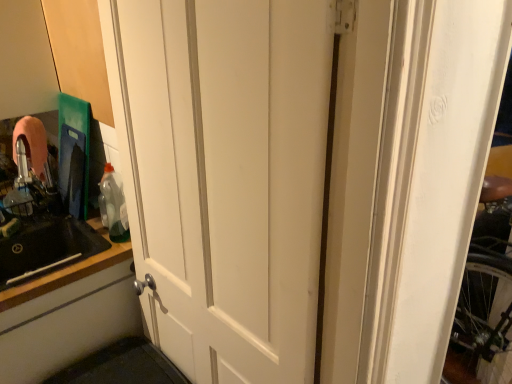
This screenshot has width=512, height=384. What are the coordinates of `white matte cabinet door at lower left` in the screenshot? It's located at (67, 325).

The width and height of the screenshot is (512, 384). Describe the element at coordinates (40, 229) in the screenshot. I see `black matte sink at left` at that location.

Find the location of a particular element. The height and width of the screenshot is (384, 512). white matte cabinet door at lower left is located at coordinates (67, 325).

From the image's perspective, is white matte cabinet door at lower left on top of black matte countertop at left?

No, from the image's perspective, white matte cabinet door at lower left is not over black matte countertop at left.

Between white matte cabinet door at lower left and black matte countertop at left, which one appears on the right side from the viewer's perspective?

white matte cabinet door at lower left is more to the right.

Would you say white matte cabinet door at lower left is inside or outside black matte countertop at left?

The correct answer is: outside.

Is white matte cabinet door at lower left placed right next to black matte countertop at left?

No.

Considering the positions of objects translucent plastic bottle at left and white matte cabinet door at lower left in the image provided, who is behind, translucent plastic bottle at left or white matte cabinet door at lower left?

translucent plastic bottle at left is more distant.

Find the location of `bottle above the white matte cabinet door at lower left (from the image's perspective)`. bottle above the white matte cabinet door at lower left (from the image's perspective) is located at coordinates [x=113, y=205].

From the image's perspective, is translucent plastic bottle at left located above or below white matte cabinet door at lower left?

From the image's perspective, translucent plastic bottle at left appears above white matte cabinet door at lower left.

Which object is wider, translucent plastic bottle at left or white matte cabinet door at lower left?

translucent plastic bottle at left is wider.

Can you confirm if translucent plastic bottle at left is taller than black matte countertop at left?

In fact, translucent plastic bottle at left may be shorter than black matte countertop at left.

Does translucent plastic bottle at left have a greater width compared to black matte countertop at left?

No.

Is translucent plastic bottle at left aimed at black matte countertop at left?

Yes, translucent plastic bottle at left faces towards black matte countertop at left.

Can you confirm if white matte cabinet door at lower left is bigger than translucent plastic bottle at left?

No, white matte cabinet door at lower left is not bigger than translucent plastic bottle at left.

From a real-world perspective, is white matte cabinet door at lower left physically below translucent plastic bottle at left?

Indeed, from a real-world perspective, white matte cabinet door at lower left is positioned beneath translucent plastic bottle at left.

Is white matte cabinet door at lower left looking in the opposite direction of translucent plastic bottle at left?

No, white matte cabinet door at lower left's orientation is not away from translucent plastic bottle at left.

Considering the relative positions of white matte cabinet door at lower left and translucent plastic bottle at left in the image provided, is white matte cabinet door at lower left to the right of translucent plastic bottle at left from the viewer's perspective?

No, white matte cabinet door at lower left is not to the right of translucent plastic bottle at left.

Is white matte cabinet door at lower left far away from black matte sink at left?

No.

Is white matte cabinet door at lower left facing towards black matte sink at left?

No, white matte cabinet door at lower left is not oriented towards black matte sink at left.

Can you confirm if white matte cabinet door at lower left is positioned to the right of black matte sink at left?

Yes.

You are a GUI agent. You are given a task and a screenshot of the screen. Output one action in this format:
    pyautogui.click(x=<x>, y=<y>)
    Task: Click on the counter top that is under the black matte sink at left (from a real-world perspective)
    Image resolution: width=512 pixels, height=384 pixels.
    Given the screenshot: What is the action you would take?
    pyautogui.click(x=68, y=272)

Are black matte countertop at left and black matte sink at left beside each other?

No, black matte countertop at left is not touching black matte sink at left.

Which object is thinner, black matte countertop at left or black matte sink at left?

black matte countertop at left.

Is black matte countertop at left positioned with its back to black matte sink at left?

Absolutely, black matte countertop at left is directed away from black matte sink at left.

Would you say black matte sink at left is to the left or to the right of translucent plastic bottle at left in the picture?

From the image, it's evident that black matte sink at left is to the left of translucent plastic bottle at left.

Which is behind, black matte sink at left or translucent plastic bottle at left?

translucent plastic bottle at left is further away from the camera.

Is translucent plastic bottle at left a part of black matte sink at left?

No, translucent plastic bottle at left is not a part of black matte sink at left.

How different are the orientations of black matte sink at left and translucent plastic bottle at left in degrees?

The angle between the facing direction of black matte sink at left and the facing direction of translucent plastic bottle at left is 1.68 degrees.

The width and height of the screenshot is (512, 384). Find the location of `counter top that is behind the white matte cabinet door at lower left`. counter top that is behind the white matte cabinet door at lower left is located at coordinates tap(68, 272).

I want to click on cabinetry in front of the translucent plastic bottle at left, so click(67, 325).

Considering their positions, is black matte countertop at left positioned closer to white matte cabinet door at lower left than translucent plastic bottle at left?

black matte countertop at left is positioned closer to the anchor white matte cabinet door at lower left.

When comparing their distances from translucent plastic bottle at left, does black matte countertop at left or white matte cabinet door at lower left seem closer?

Based on the image, black matte countertop at left appears to be nearer to translucent plastic bottle at left.

From the image, which object appears to be farther from black matte sink at left, translucent plastic bottle at left or white matte cabinet door at lower left?

The object further to black matte sink at left is white matte cabinet door at lower left.

Looking at the image, which one is located closer to black matte countertop at left, translucent plastic bottle at left or white matte cabinet door at lower left?

white matte cabinet door at lower left is closer to black matte countertop at left.

Which object lies nearer to the anchor point black matte sink at left, white matte cabinet door at lower left or translucent plastic bottle at left?

The object closer to black matte sink at left is translucent plastic bottle at left.

Based on the photo, from the image, which object appears to be farther from black matte sink at left, black matte countertop at left or white matte cabinet door at lower left?

white matte cabinet door at lower left is positioned further to the anchor black matte sink at left.

From the image, which object appears to be nearer to white matte cabinet door at lower left, black matte countertop at left or black matte sink at left?

black matte countertop at left is closer to white matte cabinet door at lower left.

Which object lies nearer to the anchor point translucent plastic bottle at left, white matte cabinet door at lower left or black matte countertop at left?

Among the two, black matte countertop at left is located nearer to translucent plastic bottle at left.

You are a GUI agent. You are given a task and a screenshot of the screen. Output one action in this format:
    pyautogui.click(x=<x>, y=<y>)
    Task: Click on the counter top between black matte sink at left and translucent plastic bottle at left in the front-back direction
    This screenshot has height=384, width=512.
    Given the screenshot: What is the action you would take?
    coord(68,272)

At what (x,y) coordinates should I click in order to perform the action: click on counter top between white matte cabinet door at lower left and translucent plastic bottle at left in the front-back direction. Please return your answer as a coordinate pair (x, y). Image resolution: width=512 pixels, height=384 pixels. Looking at the image, I should click on (68, 272).

This screenshot has width=512, height=384. Find the location of `cabinetry between black matte sink at left and translucent plastic bottle at left along the z-axis`. cabinetry between black matte sink at left and translucent plastic bottle at left along the z-axis is located at coordinates (67, 325).

The height and width of the screenshot is (384, 512). In order to click on counter top between black matte sink at left and white matte cabinet door at lower left in the horizontal direction in this screenshot , I will do `click(68, 272)`.